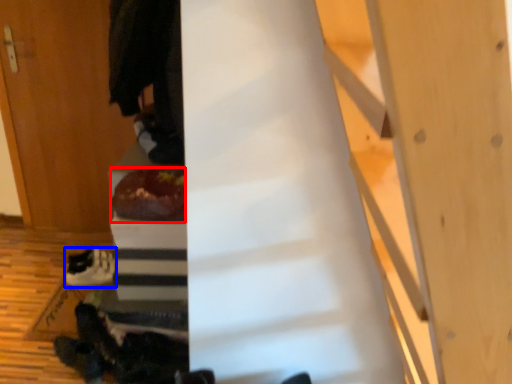
Question: Which object is closer to the camera taking this photo, food (highlighted by a red box) or footwear (highlighted by a blue box)?

Choices:
 (A) food
 (B) footwear

Answer: (A)